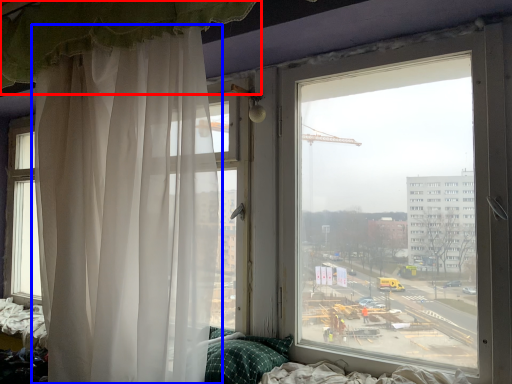
Question: Which of the following is the closest to the observer, curtain (highlighted by a red box) or curtain (highlighted by a blue box)?

Choices:
 (A) curtain
 (B) curtain

Answer: (A)